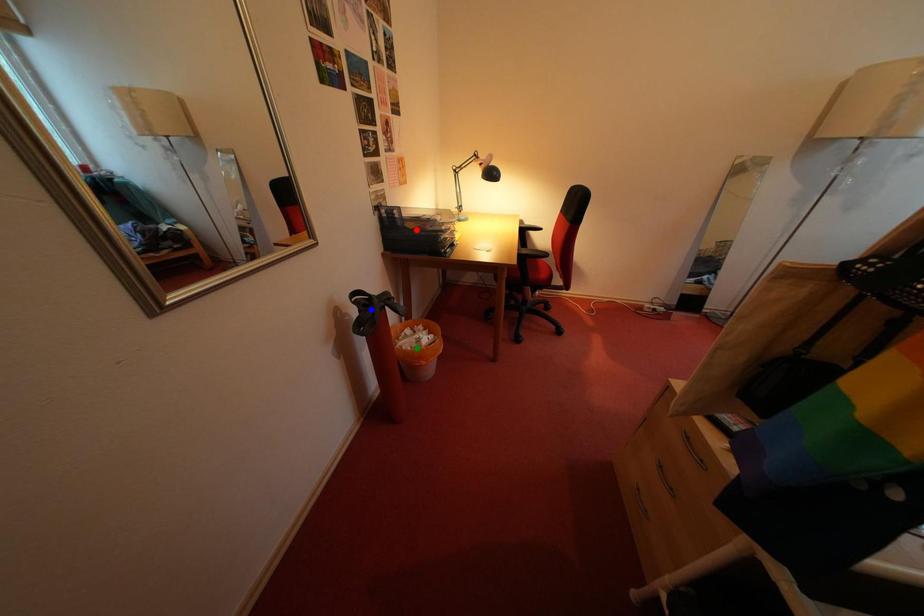
Order these from nearest to farthest:
1. blue point
2. red point
3. green point

1. blue point
2. red point
3. green point